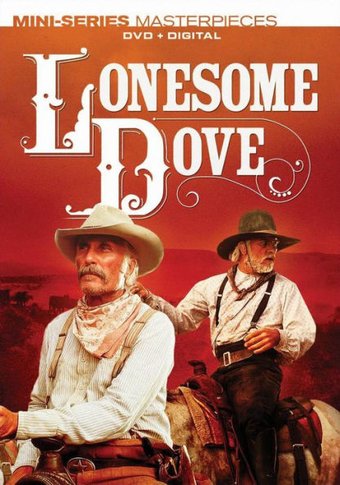
Identify the location of white border at top. (7, 16), (308, 18), (183, 19).